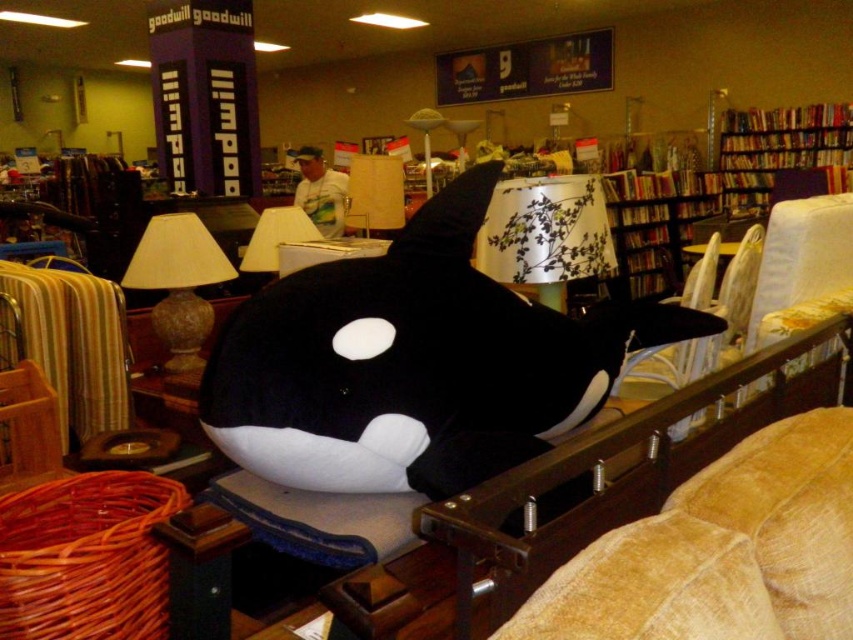
You are an interior designer planning to place a new rectangular table between the wooden bookshelf at upper right and the beige fabric lampshade at center. The table is 1.2 meters wide. Can the table fit in the space between them?

The wooden bookshelf at upper right might be wider than beige fabric lampshade at center, so the space between them may not be wide enough for a 1.2 meter table. Check the exact width before placing the table.

You are a customer in a Goodwill store and want to find the black plush whale at center. You see the white paper lampshade at center. Which direction should you move from the lampshade to locate the whale?

The black plush whale at center is to the right of the white paper lampshade at center, so you should move to the right of the lampshade to find the whale.